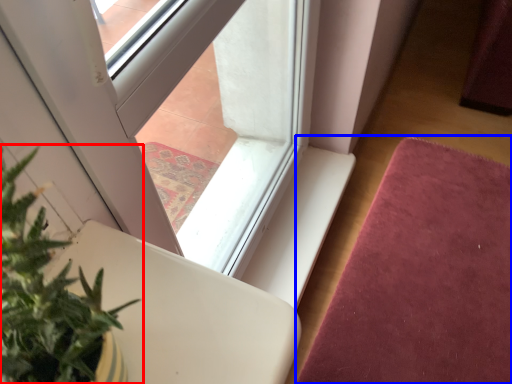
Question: Which object appears closest to the camera in this image, houseplant (highlighted by a red box) or mat (highlighted by a blue box)?

Choices:
 (A) houseplant
 (B) mat

Answer: (A)